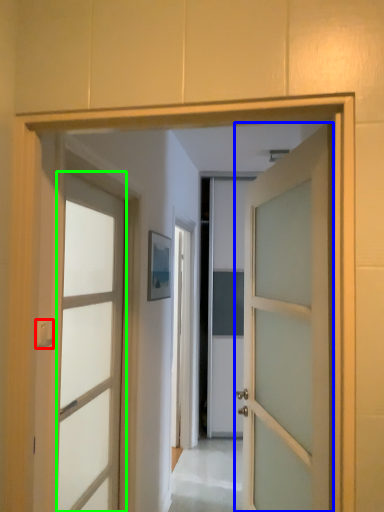
Question: Which is nearer to the door handle (highlighted by a red box)? door (highlighted by a blue box) or door (highlighted by a green box).

Choices:
 (A) door
 (B) door

Answer: (B)